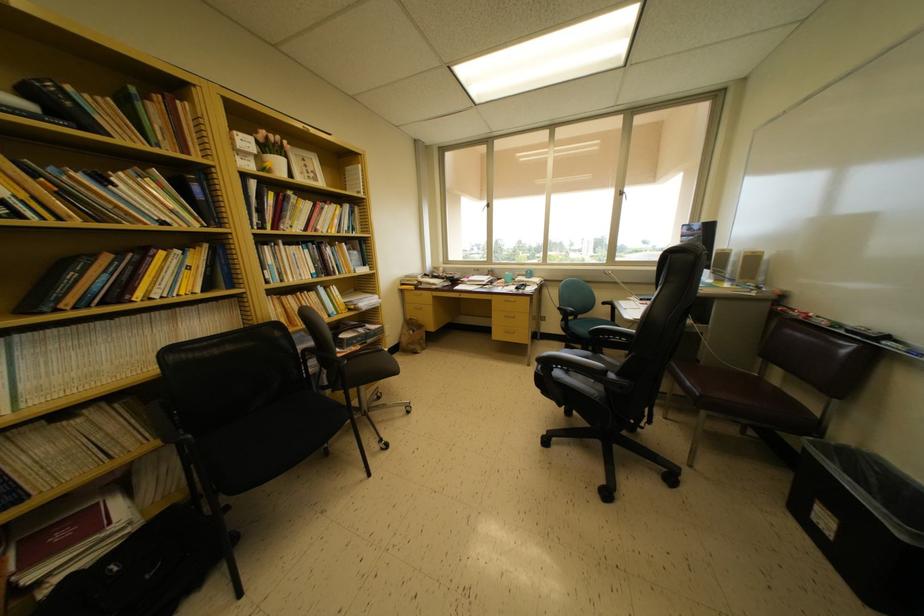
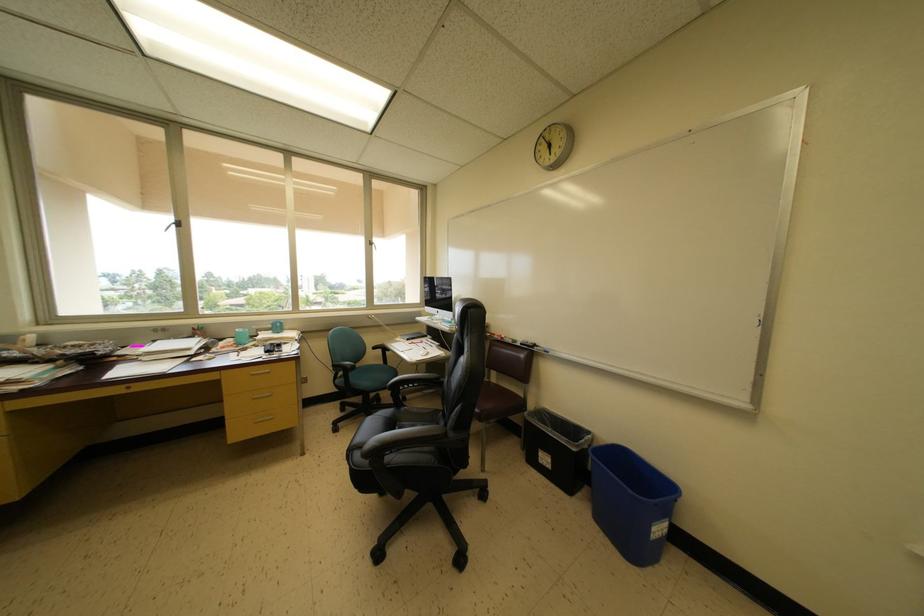
Where in the second image is the point corresponding to pixel 672 557 from the first image?

(520, 573)